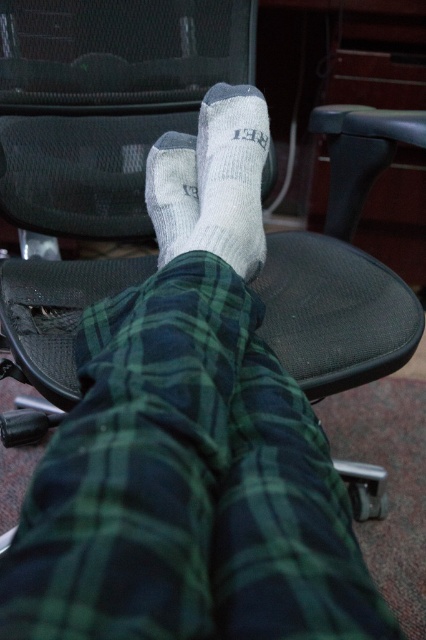
You are a photographer adjusting the focus of your camera. The camera is currently focused on the point at coordinates point [187,484]. Based on the scene, what object is the camera focused on?

The point [187,484] is on green plaid pants at center, so the camera is focused on the green plaid pants at center.